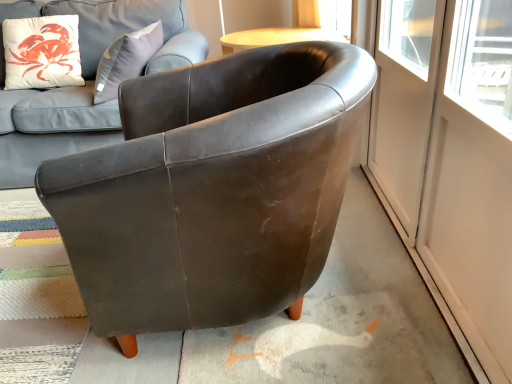
Where is `vacant space in transparent glass screen door at right, which is the 2th screen door from right to left (from a real-world perspective)`? The width and height of the screenshot is (512, 384). vacant space in transparent glass screen door at right, which is the 2th screen door from right to left (from a real-world perspective) is located at coordinates (396, 262).